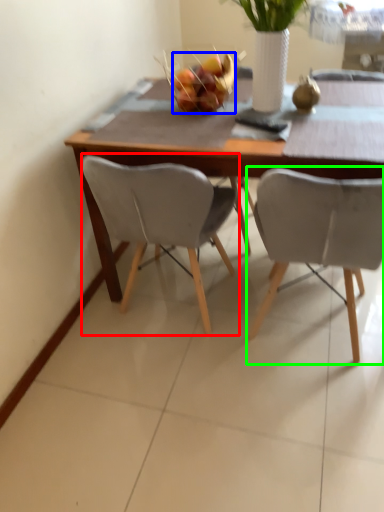
Question: Estimate the real-world distances between objects in this image. Which object is farther from chair (highlighted by a red box), fruit (highlighted by a blue box) or chair (highlighted by a green box)?

Choices:
 (A) fruit
 (B) chair

Answer: (A)